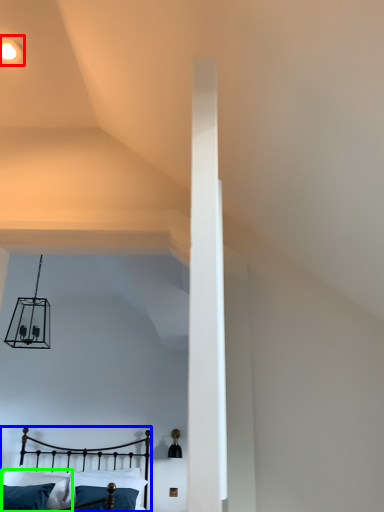
Question: Which object is positioned farthest from light fixture (highlighted by a red box)? Select from bed (highlighted by a blue box) and pillow (highlighted by a green box).

Choices:
 (A) bed
 (B) pillow

Answer: (A)